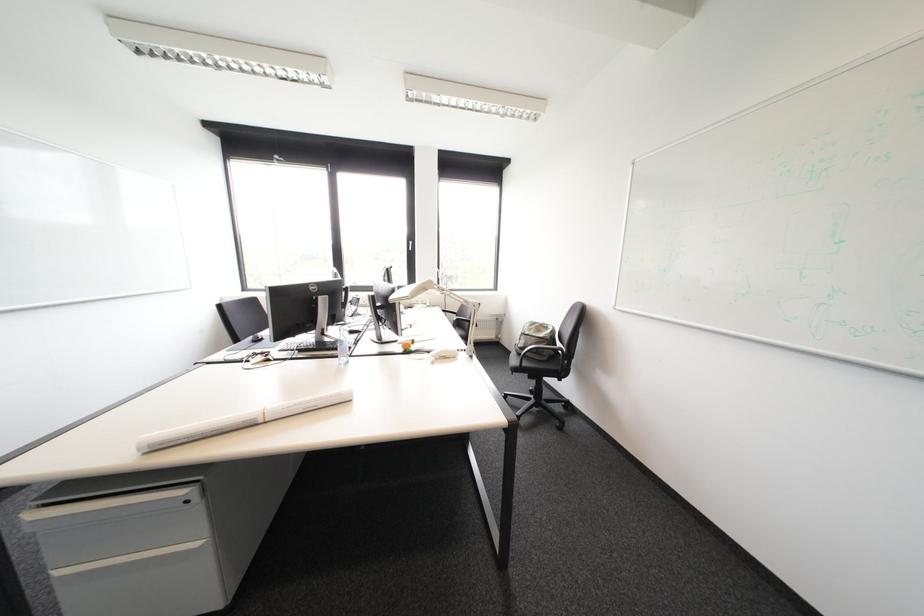
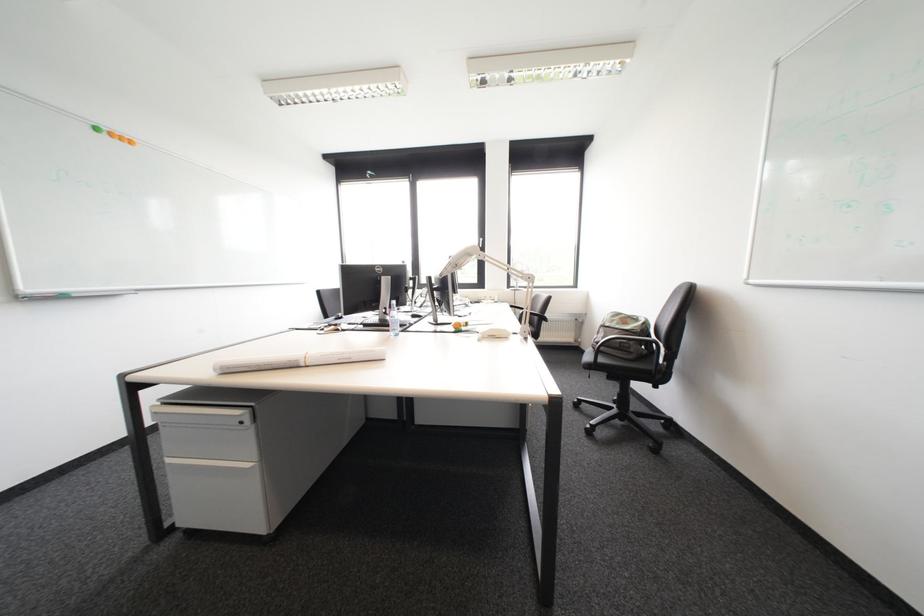
Question: Based on the continuous images, in which direction is the camera rotating? Reply with the corresponding letter.

Choices:
 (A) Left
 (B) Right
 (C) Up
 (D) Down

Answer: (A)